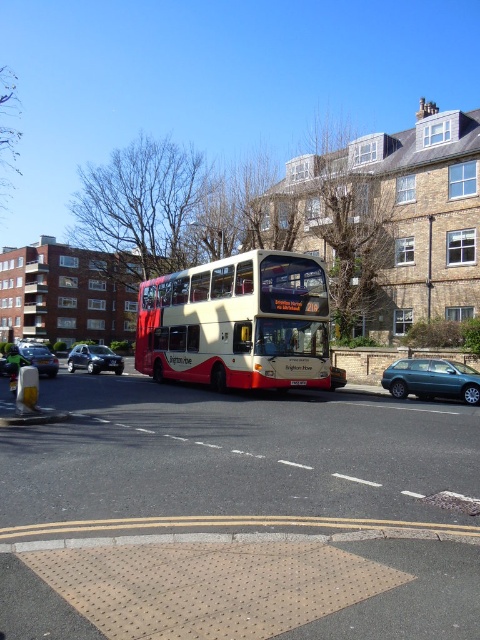
Who is positioned more to the left, white matte double-decker bus at center or metallic teal hatchback at center right?

From the viewer's perspective, white matte double-decker bus at center appears more on the left side.

Is point (153, 332) behind point (437, 387)?

Yes, point (153, 332) is behind point (437, 387).

Identify the location of white matte double-decker bus at center. (237, 323).

Who is shorter, white matte double-decker bus at center or shiny black sedan at left?

shiny black sedan at left is shorter.

Does white matte double-decker bus at center have a lesser width compared to shiny black sedan at left?

Indeed, white matte double-decker bus at center has a lesser width compared to shiny black sedan at left.

This screenshot has width=480, height=640. Describe the element at coordinates (237, 323) in the screenshot. I see `white matte double-decker bus at center` at that location.

Image resolution: width=480 pixels, height=640 pixels. What are the coordinates of `white matte double-decker bus at center` in the screenshot? It's located at (237, 323).

Who is more forward, (441,376) or (87,355)?

Positioned in front is point (441,376).

Is metallic teal hatchback at center right to the left of metallic silver hatchback at lower left from the viewer's perspective?

In fact, metallic teal hatchback at center right is to the right of metallic silver hatchback at lower left.

Locate an element on the screen. metallic teal hatchback at center right is located at coordinates (432, 380).